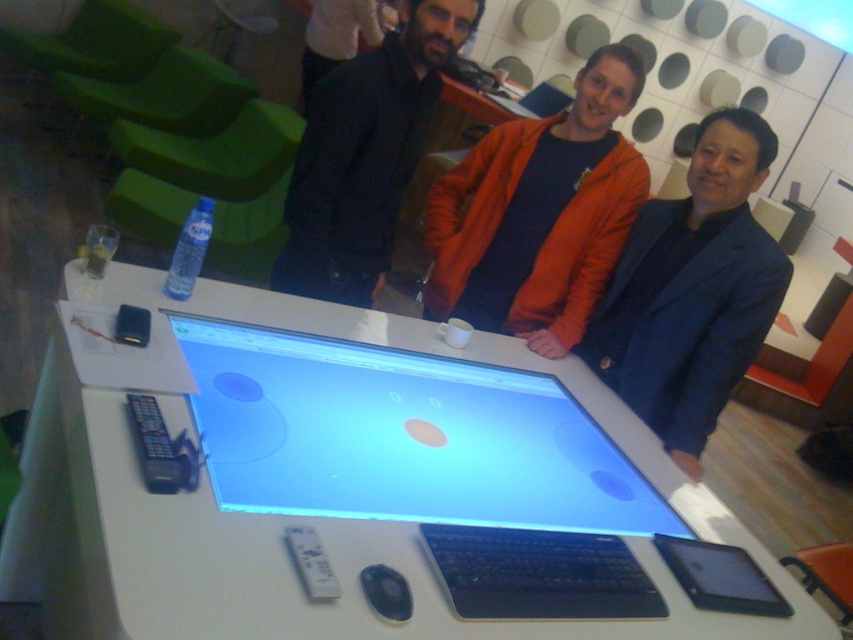
Question: Considering the relative positions of dark blue textured blazer at center and matte black laptop at center in the image provided, where is dark blue textured blazer at center located with respect to matte black laptop at center?

Choices:
 (A) right
 (B) left

Answer: (A)

Question: Among these objects, which one is nearest to the camera?

Choices:
 (A) black plastic mouse at center
 (B) white glossy table at center

Answer: (B)

Question: Is black matte jacket at upper center above dark blue jacket at center?

Choices:
 (A) no
 (B) yes

Answer: (A)

Question: Is white glossy table at center to the right of matte black laptop at center from the viewer's perspective?

Choices:
 (A) no
 (B) yes

Answer: (A)

Question: Which of these objects is positioned closest to the black plastic mouse at center?

Choices:
 (A) dark blue jacket at center
 (B) white glossy table at center

Answer: (B)

Question: Which of these objects is positioned closest to the orange fleece jacket at center?

Choices:
 (A) dark blue jacket at center
 (B) white glossy table at center

Answer: (B)